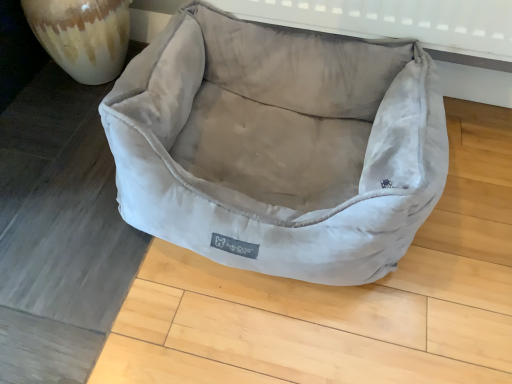
Question: Could you tell me if suede-like beige dog bed at center is facing marbled ceramic vase at left?

Choices:
 (A) no
 (B) yes

Answer: (A)

Question: Is marbled ceramic vase at left located within suede-like beige dog bed at center?

Choices:
 (A) no
 (B) yes

Answer: (A)

Question: Is suede-like beige dog bed at center in contact with marbled ceramic vase at left?

Choices:
 (A) yes
 (B) no

Answer: (B)

Question: From a real-world perspective, is suede-like beige dog bed at center on marbled ceramic vase at left?

Choices:
 (A) yes
 (B) no

Answer: (A)

Question: Is the position of suede-like beige dog bed at center more distant than that of marbled ceramic vase at left?

Choices:
 (A) yes
 (B) no

Answer: (B)

Question: From the image's perspective, is suede-like beige dog bed at center on marbled ceramic vase at left?

Choices:
 (A) yes
 (B) no

Answer: (B)

Question: Is marbled ceramic vase at left closer to the viewer compared to suede-like beige dog bed at center?

Choices:
 (A) yes
 (B) no

Answer: (B)

Question: Is marbled ceramic vase at left facing away from suede-like beige dog bed at center?

Choices:
 (A) yes
 (B) no

Answer: (B)

Question: Does marbled ceramic vase at left turn towards suede-like beige dog bed at center?

Choices:
 (A) yes
 (B) no

Answer: (B)

Question: Does marbled ceramic vase at left have a lesser height compared to suede-like beige dog bed at center?

Choices:
 (A) yes
 (B) no

Answer: (A)

Question: Does marbled ceramic vase at left have a greater height compared to suede-like beige dog bed at center?

Choices:
 (A) no
 (B) yes

Answer: (A)

Question: Is marbled ceramic vase at left further to the viewer compared to suede-like beige dog bed at center?

Choices:
 (A) no
 (B) yes

Answer: (B)

Question: Visually, is marbled ceramic vase at left positioned to the left or to the right of suede-like beige dog bed at center?

Choices:
 (A) right
 (B) left

Answer: (B)